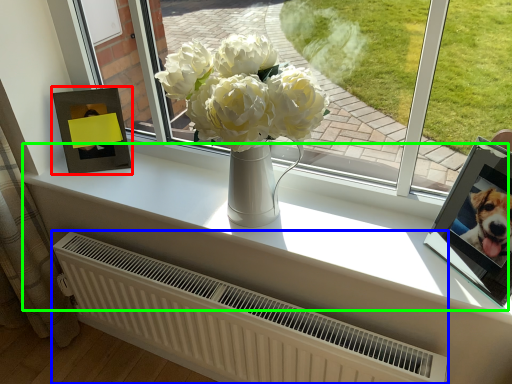
Question: Which is farther away from picture frame (highlighted by a red box)? radiator (highlighted by a blue box) or window sill (highlighted by a green box)?

Choices:
 (A) radiator
 (B) window sill

Answer: (A)